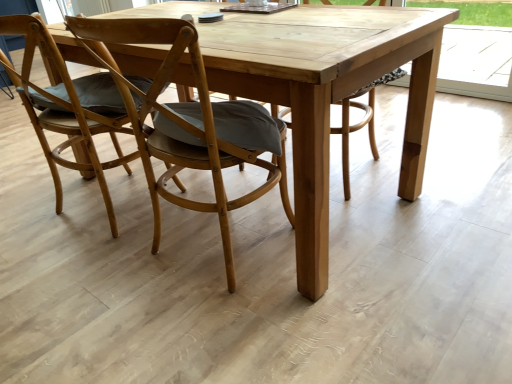
Question: From a real-world perspective, does wooden chair with cushion at center, which is the 2th chair from left to right, stand above natural wood picnic table at center?

Choices:
 (A) no
 (B) yes

Answer: (B)

Question: From the image's perspective, does wooden chair with cushion at center, which is the 2th chair from left to right, appear higher than natural wood picnic table at center?

Choices:
 (A) yes
 (B) no

Answer: (B)

Question: Is wooden chair with cushion at center, which is the 1th chair in right-to-left order, at the left side of natural wood picnic table at center?

Choices:
 (A) no
 (B) yes

Answer: (B)

Question: Is wooden chair with cushion at center, which is the 1th chair in right-to-left order, at the right side of natural wood picnic table at center?

Choices:
 (A) yes
 (B) no

Answer: (B)

Question: Is wooden chair with cushion at center, which is the 2th chair from left to right, behind natural wood picnic table at center?

Choices:
 (A) no
 (B) yes

Answer: (A)

Question: Based on their positions, is wooden chair at left, marked as the 2th chair in a right-to-left arrangement, located to the left or right of wooden chair with cushion at center, which is the 2th chair from left to right?

Choices:
 (A) right
 (B) left

Answer: (B)

Question: Considering the positions of wooden chair at left, marked as the 2th chair in a right-to-left arrangement, and wooden chair with cushion at center, which is the 1th chair in right-to-left order, in the image, is wooden chair at left, marked as the 2th chair in a right-to-left arrangement, bigger or smaller than wooden chair with cushion at center, which is the 1th chair in right-to-left order,?

Choices:
 (A) small
 (B) big

Answer: (B)

Question: From their relative heights in the image, would you say wooden chair at left, positioned as the 1th chair in left-to-right order, is taller or shorter than wooden chair with cushion at center, which is the 2th chair from left to right?

Choices:
 (A) tall
 (B) short

Answer: (B)

Question: Does point (22, 64) appear closer or farther from the camera than point (148, 39)?

Choices:
 (A) closer
 (B) farther

Answer: (B)

Question: From the image's perspective, is wooden chair at left, positioned as the 1th chair in left-to-right order, above or below natural wood picnic table at center?

Choices:
 (A) below
 (B) above

Answer: (A)

Question: Considering the positions of wooden chair at left, marked as the 2th chair in a right-to-left arrangement, and natural wood picnic table at center in the image, is wooden chair at left, marked as the 2th chair in a right-to-left arrangement, wider or thinner than natural wood picnic table at center?

Choices:
 (A) thin
 (B) wide

Answer: (A)

Question: Based on their sizes in the image, would you say wooden chair at left, positioned as the 1th chair in left-to-right order, is bigger or smaller than natural wood picnic table at center?

Choices:
 (A) big
 (B) small

Answer: (B)

Question: Would you say wooden chair at left, positioned as the 1th chair in left-to-right order, is to the left or to the right of natural wood picnic table at center in the picture?

Choices:
 (A) left
 (B) right

Answer: (A)

Question: Is point [x=232, y=271] positioned closer to the camera than point [x=375, y=51]?

Choices:
 (A) closer
 (B) farther

Answer: (B)

Question: Is wooden chair with cushion at center, which is the 2th chair from left to right, bigger or smaller than natural wood picnic table at center?

Choices:
 (A) small
 (B) big

Answer: (A)